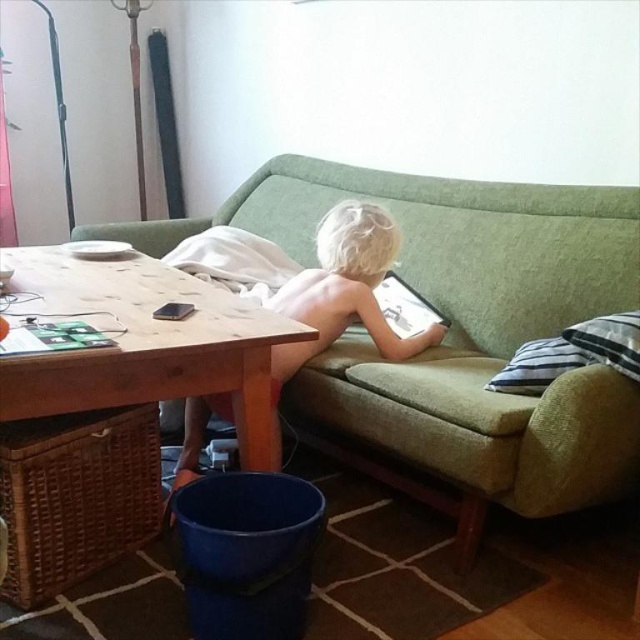
Question: Which of the following is the farthest from the observer?

Choices:
 (A) (381, 312)
 (B) (195, 412)
 (C) (476, 438)

Answer: (A)

Question: Is the position of green fabric couch at center more distant than that of blonde hair child at center?

Choices:
 (A) no
 (B) yes

Answer: (A)

Question: Which object is farther from the camera taking this photo?

Choices:
 (A) matte black tablet at center
 (B) blonde hair child at center
 (C) green fabric couch at center

Answer: (A)

Question: Which of the following is the closest to the observer?

Choices:
 (A) green fabric couch at center
 (B) blonde hair child at center
 (C) woodenmaterial/texturetable at left
 (D) matte black tablet at center

Answer: (C)

Question: Can you confirm if woodenmaterial/texturetable at left is positioned below matte black tablet at center?

Choices:
 (A) yes
 (B) no

Answer: (A)

Question: Is green fabric couch at center behind blonde hair child at center?

Choices:
 (A) no
 (B) yes

Answer: (A)